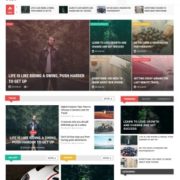
Find the location of `photographs`. photographs is located at coordinates [49, 48], [109, 37], [153, 35], [148, 72], [109, 66], [148, 115], [33, 120], [89, 173], [30, 172].